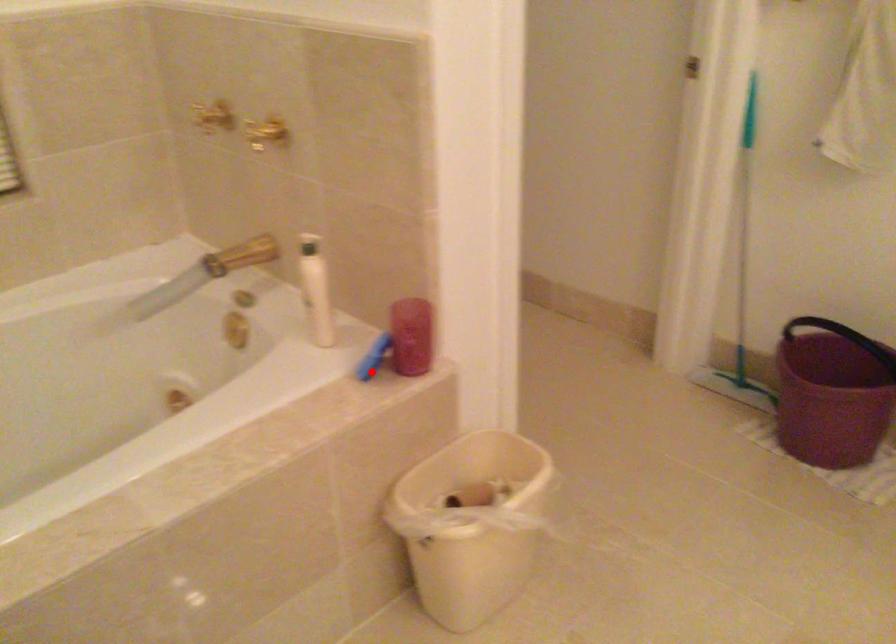
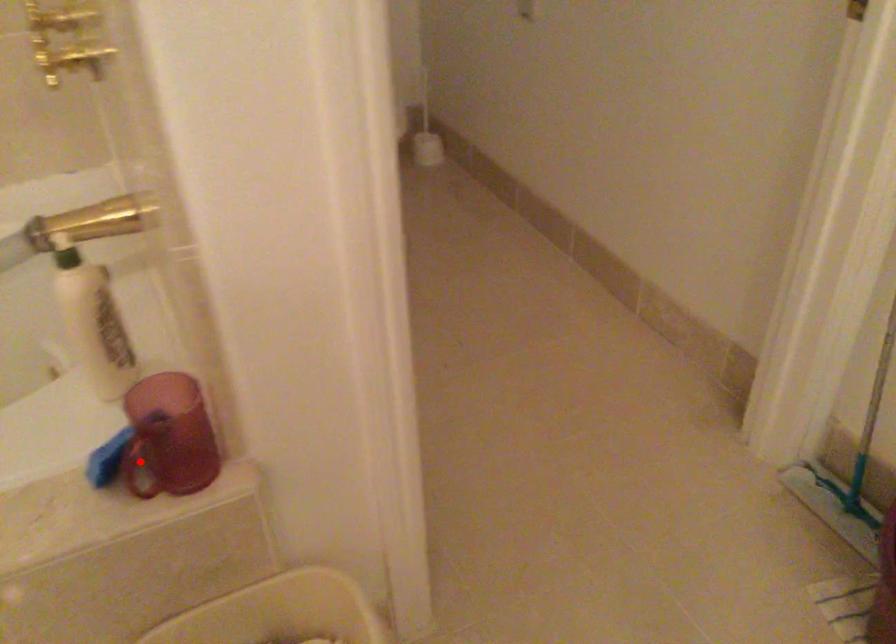
I am providing you with two images of the same scene from different viewpoints. A red point is marked on the first image and another point is marked on the second image. Does the point marked in image1 correspond to the same location as the one in image2?

Yes